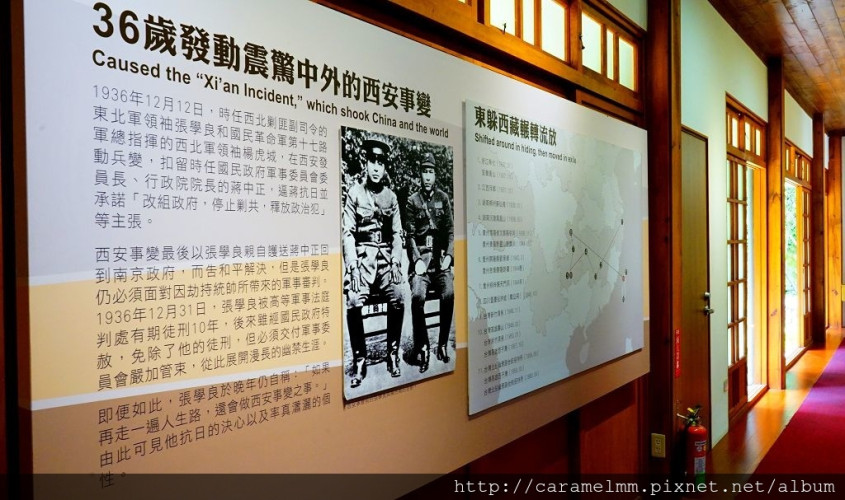
I want to click on brown floor, so click(766, 423).